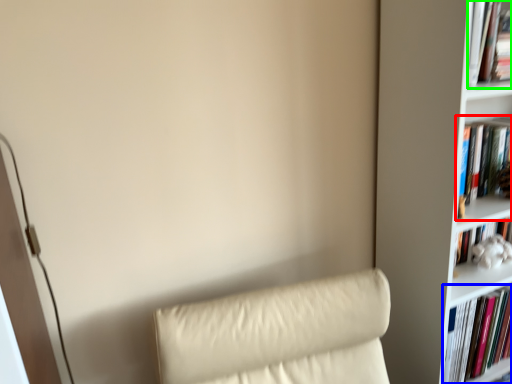
Question: Based on their relative distances, which object is nearer to book (highlighted by a red box)? Choose from book (highlighted by a blue box) and book (highlighted by a green box).

Choices:
 (A) book
 (B) book

Answer: (B)